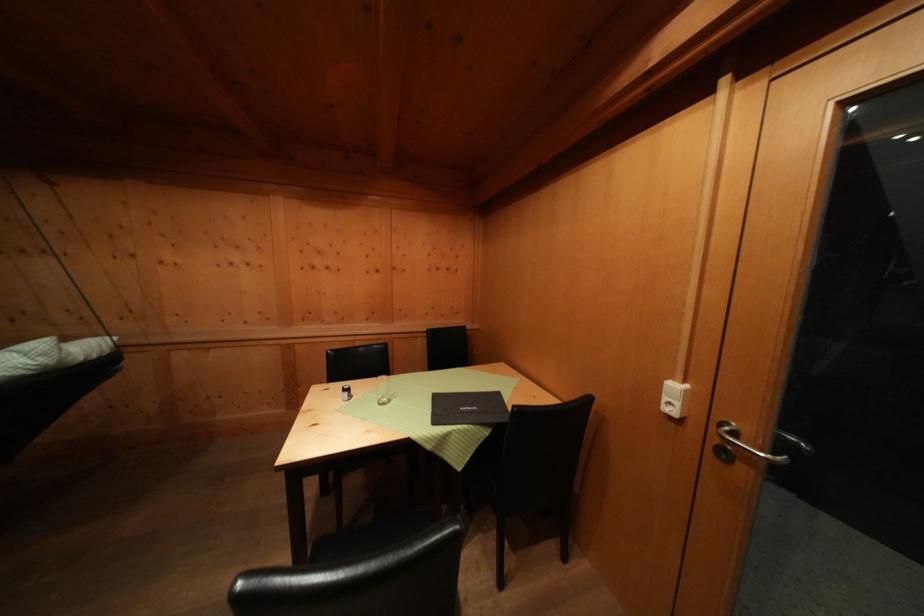
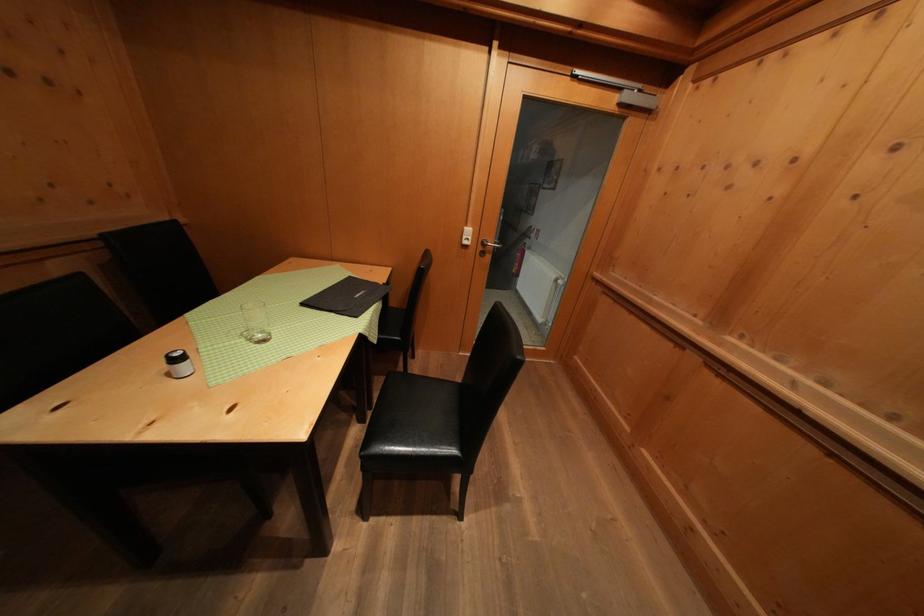
In the second image, find the point that corresponds to point (391, 405) in the first image.

(264, 341)